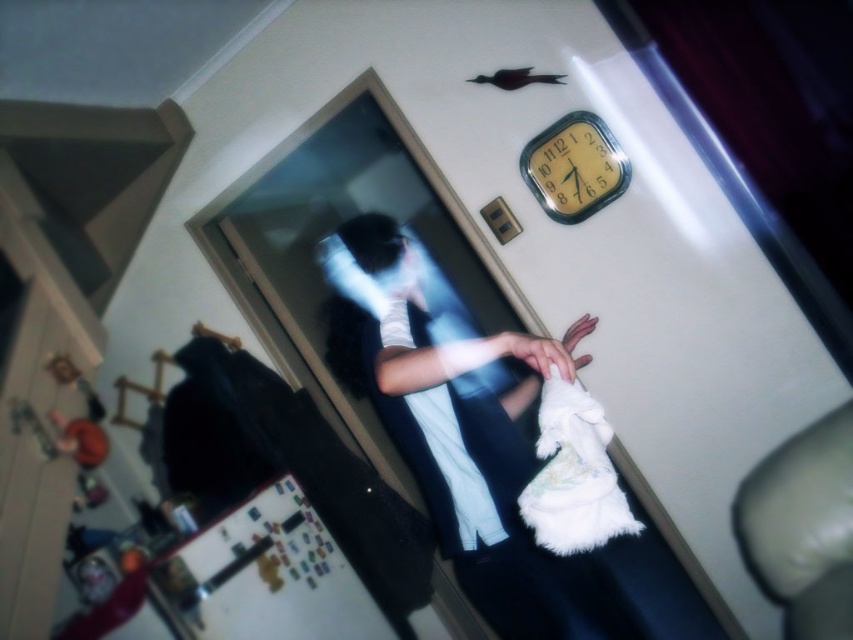
Who is positioned more to the right, white fluffy towel at center or yellow matte clock at upper center?

yellow matte clock at upper center

What do you see at coordinates (457, 435) in the screenshot?
I see `white fluffy towel at center` at bounding box center [457, 435].

The width and height of the screenshot is (853, 640). Identify the location of white fluffy towel at center. (457, 435).